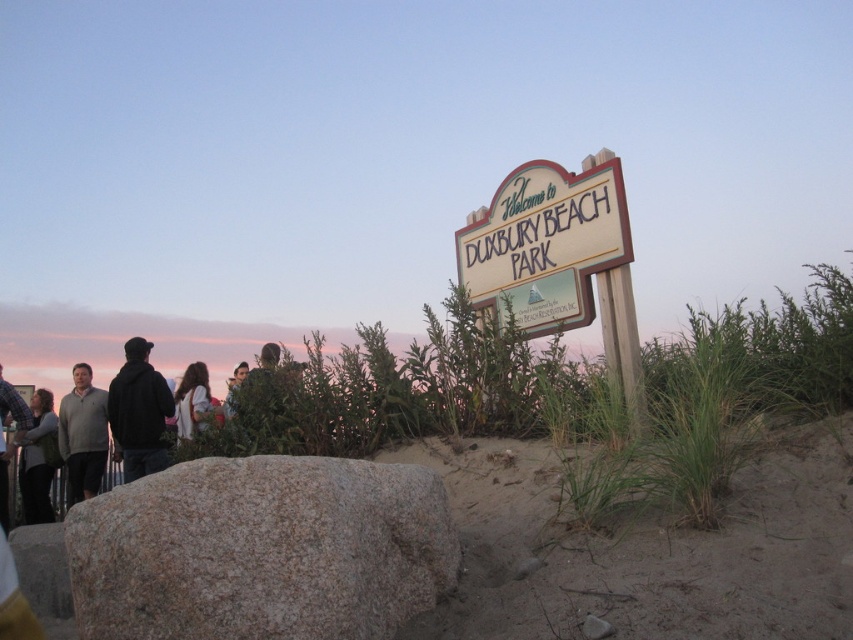
Question: Is beige wood sign at center to the right of light brown hair at center from the viewer's perspective?

Choices:
 (A) no
 (B) yes

Answer: (B)

Question: Among these objects, which one is nearest to the camera?

Choices:
 (A) dark brown hair at center
 (B) granite rock at lower left
 (C) light brown hair at center

Answer: (B)

Question: Which point is closer to the camera?

Choices:
 (A) gray sweater at left
 (B) dark brown hair at center
 (C) beige wood sign at center
 (D) black hoodie at left

Answer: (C)

Question: Which point is farther from the camera taking this photo?

Choices:
 (A) (554, 621)
 (B) (184, 401)

Answer: (B)

Question: Does granite rock at lower left appear over matte gray sweater at lower left?

Choices:
 (A) no
 (B) yes

Answer: (B)

Question: Is light brown hair at center smaller than dark brown leather jacket at center?

Choices:
 (A) yes
 (B) no

Answer: (B)